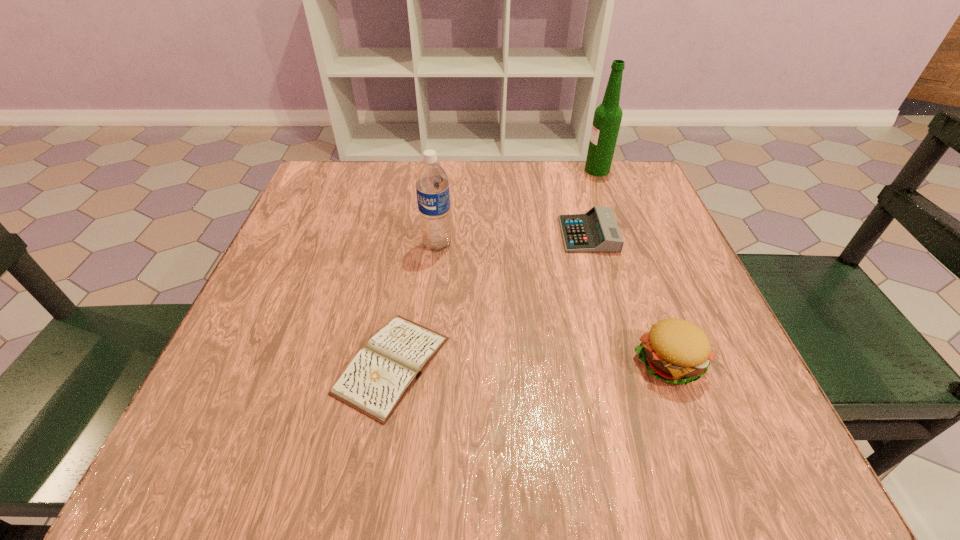
Locate an element on the screen. free space that satisfies the following two spatial constraints: 1. on the label of the hamburger; 2. on the right side of the beer bottle is located at coordinates (667, 361).